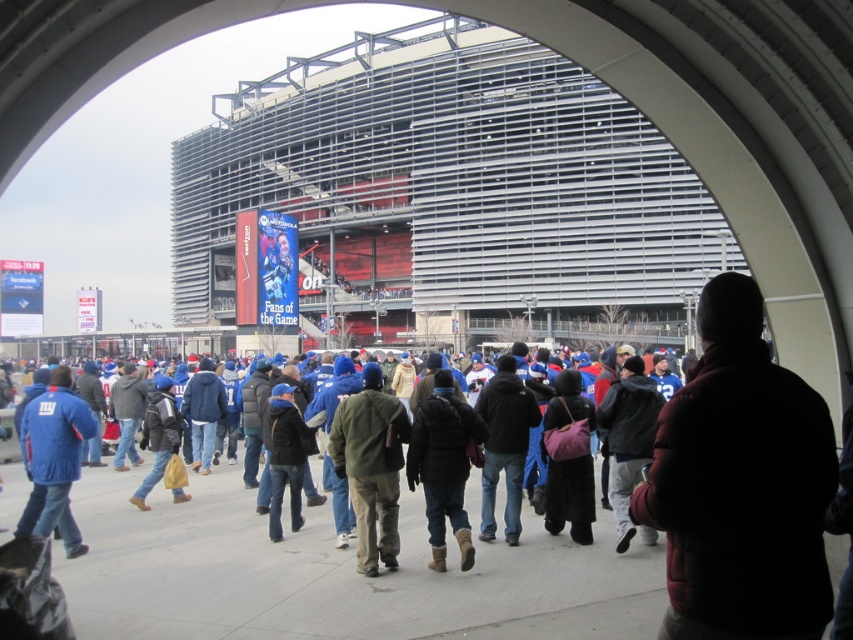
In the scene shown: Does green matte jacket at center have a greater width compared to dark brown leather jacket at center?

Indeed, green matte jacket at center has a greater width compared to dark brown leather jacket at center.

Is green matte jacket at center taller than dark brown leather jacket at center?

Indeed, green matte jacket at center has a greater height compared to dark brown leather jacket at center.

Between point (390, 563) and point (428, 538), which one is positioned behind?

Positioned behind is point (428, 538).

Identify the location of green matte jacket at center. (370, 465).

Does dark brown leather jacket at center appear over matte blue jacket at center-left?

No, dark brown leather jacket at center is not above matte blue jacket at center-left.

Who is more forward, (416, 417) or (45, 435)?

Point (45, 435) is in front.

Is point (438, 516) farther from camera compared to point (84, 426)?

No, (438, 516) is in front of (84, 426).

Where is `dark brown leather jacket at center`? This screenshot has width=853, height=640. dark brown leather jacket at center is located at coordinates (444, 465).

The height and width of the screenshot is (640, 853). What do you see at coordinates (740, 484) in the screenshot?
I see `dark red puffy coat at center` at bounding box center [740, 484].

Who is higher up, dark red puffy coat at center or matte blue jacket at center-left?

dark red puffy coat at center

Describe the element at coordinates (740, 484) in the screenshot. I see `dark red puffy coat at center` at that location.

Where is `dark red puffy coat at center`? Image resolution: width=853 pixels, height=640 pixels. dark red puffy coat at center is located at coordinates (740, 484).